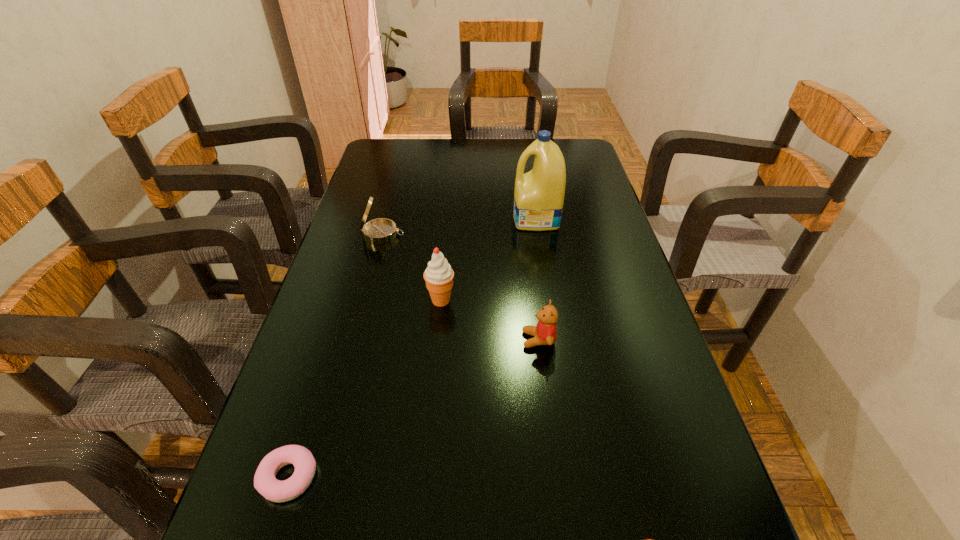
Where is `object that ranks as the fourth closest to the icecream`? The width and height of the screenshot is (960, 540). object that ranks as the fourth closest to the icecream is located at coordinates (265, 483).

Select which object is the third closest to the detergent. Please provide its 2D coordinates. Your answer should be formatted as a tuple, i.e. [(x, y)], where the tuple contains the x and y coordinates of a point satisfying the conditions above.

[(545, 332)]

The width and height of the screenshot is (960, 540). Find the location of `vacant area in the image that satisfies the following two spatial constraints: 1. on the label of the tallest object; 2. on the front side of the icecream`. vacant area in the image that satisfies the following two spatial constraints: 1. on the label of the tallest object; 2. on the front side of the icecream is located at coordinates (549, 300).

Where is `free space that satisfies the following two spatial constraints: 1. with the dial facing the left compass; 2. on the back side of the second tallest object`? The height and width of the screenshot is (540, 960). free space that satisfies the following two spatial constraints: 1. with the dial facing the left compass; 2. on the back side of the second tallest object is located at coordinates (366, 300).

Identify the location of free spot that satisfies the following two spatial constraints: 1. with the dial facing the taller compass; 2. on the front side of the fifth farthest object. (319, 477).